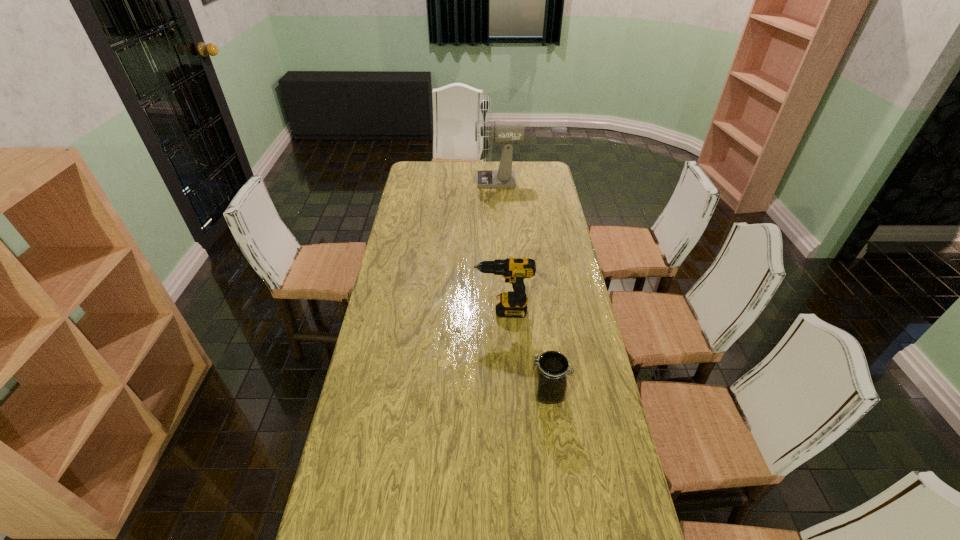
You are a GUI agent. You are given a task and a screenshot of the screen. Output one action in this format:
    pyautogui.click(x=<x>, y=<y>)
    Task: Click on the vacant space located 0.210m at the tip of the second farthest object
    
    Given the screenshot: What is the action you would take?
    pyautogui.click(x=416, y=310)

I want to click on vacant point located 0.280m at the tip of the second farthest object, so 396,310.

Find the location of `blank area located on the lid of the jar`. blank area located on the lid of the jar is located at coordinates (491, 394).

Where is `free location located on the lid of the jar`? This screenshot has width=960, height=540. free location located on the lid of the jar is located at coordinates (421, 394).

I want to click on vacant space situated on the lid of the jar, so click(484, 394).

The height and width of the screenshot is (540, 960). Identify the location of object that is positioned at the far edge. (501, 131).

Where is `object that is at the right edge`? object that is at the right edge is located at coordinates (550, 382).

Identify the location of vacant space at the far edge of the desktop. Image resolution: width=960 pixels, height=540 pixels. (513, 167).

The width and height of the screenshot is (960, 540). I want to click on vacant area at the left edge of the desktop, so (x=399, y=285).

Where is `vacant space at the right edge of the desktop`? vacant space at the right edge of the desktop is located at coordinates (562, 341).